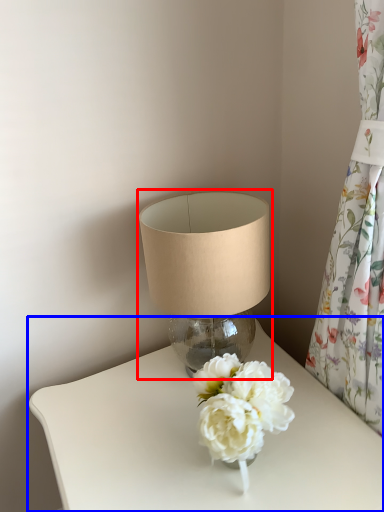
Question: Among these objects, which one is nearest to the camera, lamp (highlighted by a red box) or table (highlighted by a blue box)?

Choices:
 (A) lamp
 (B) table

Answer: (B)